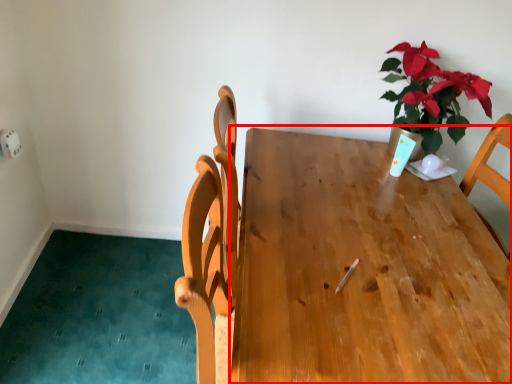
Question: Considering the relative positions of table (annotated by the red box) and houseplant in the image provided, where is table (annotated by the red box) located with respect to the staircase?

Choices:
 (A) right
 (B) left

Answer: (B)